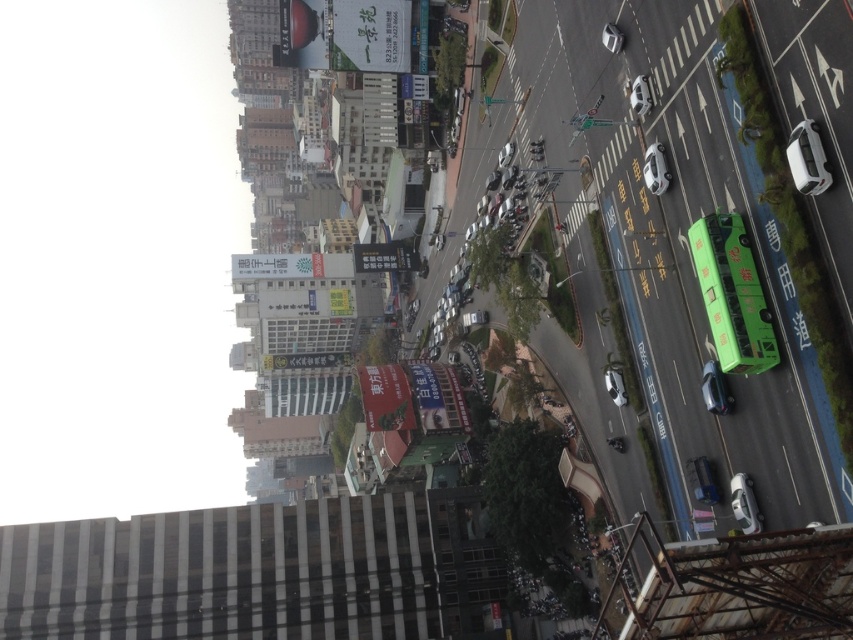
Question: Does shiny silver car at right have a greater width compared to white glossy car at center-right?

Choices:
 (A) yes
 (B) no

Answer: (A)

Question: Which point is farther to the camera?

Choices:
 (A) (798, 145)
 (B) (666, 177)
 (C) (753, 496)
 (D) (640, 76)

Answer: (D)

Question: Which of the following is the closest to the observer?

Choices:
 (A) white glossy car at center-right
 (B) white matte car at upper right
 (C) white glossy car at upper right
 (D) shiny silver car at right

Answer: (B)

Question: Does white glossy car at center-right have a greater width compared to white glossy car at upper right?

Choices:
 (A) yes
 (B) no

Answer: (B)

Question: Among these points, which one is farthest from the camera?

Choices:
 (A) (747, 502)
 (B) (720, 380)

Answer: (B)

Question: In this image, where is white glossy car at center-right located relative to white glossy car at upper right?

Choices:
 (A) right
 (B) left

Answer: (A)